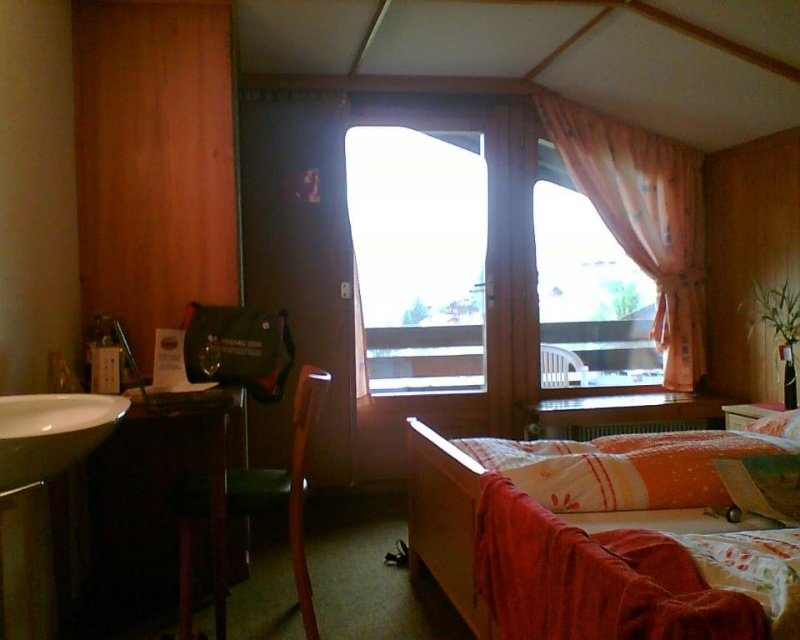
Question: Which point is closer to the camera?

Choices:
 (A) (440, 380)
 (B) (645, 209)
 (C) (78, 413)

Answer: (C)

Question: Based on their relative distances, which object is nearer to the green fabric chair at lower left?

Choices:
 (A) white glossy sink at lower left
 (B) matte plastic chair at center
 (C) transparent glass window at center
 (D) pink fabric curtain at upper right

Answer: (A)

Question: Can you confirm if transparent glass window at center is wider than white glossy sink at lower left?

Choices:
 (A) no
 (B) yes

Answer: (B)

Question: From the image, what is the correct spatial relationship of green fabric chair at lower left in relation to matte plastic chair at center?

Choices:
 (A) below
 (B) above

Answer: (A)

Question: Does pink fabric curtain at upper right appear under green fabric chair at lower left?

Choices:
 (A) yes
 (B) no

Answer: (B)

Question: Estimate the real-world distances between objects in this image. Which object is closer to the pink fabric curtain at upper right?

Choices:
 (A) green fabric chair at lower left
 (B) matte plastic chair at center
 (C) transparent glass window at center
 (D) white glossy sink at lower left

Answer: (B)